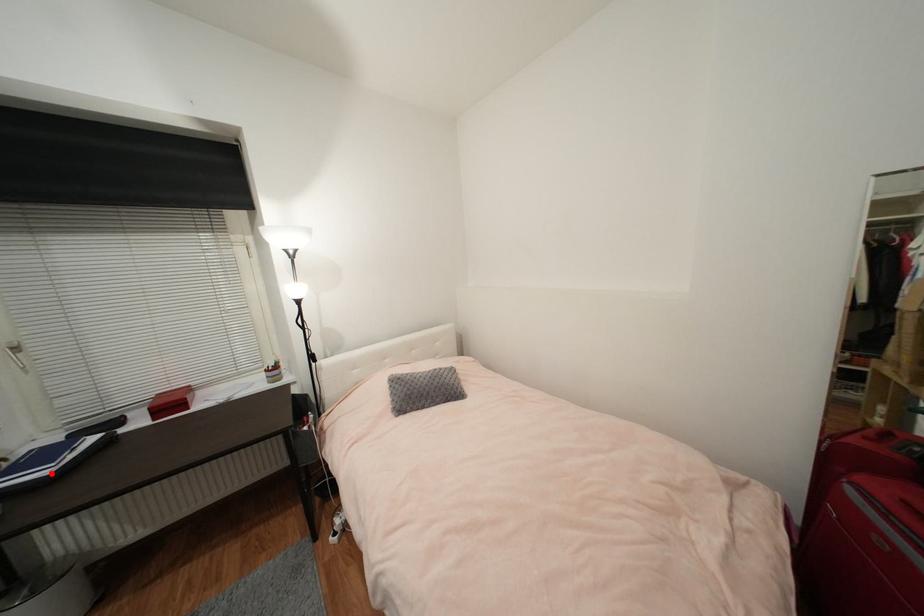
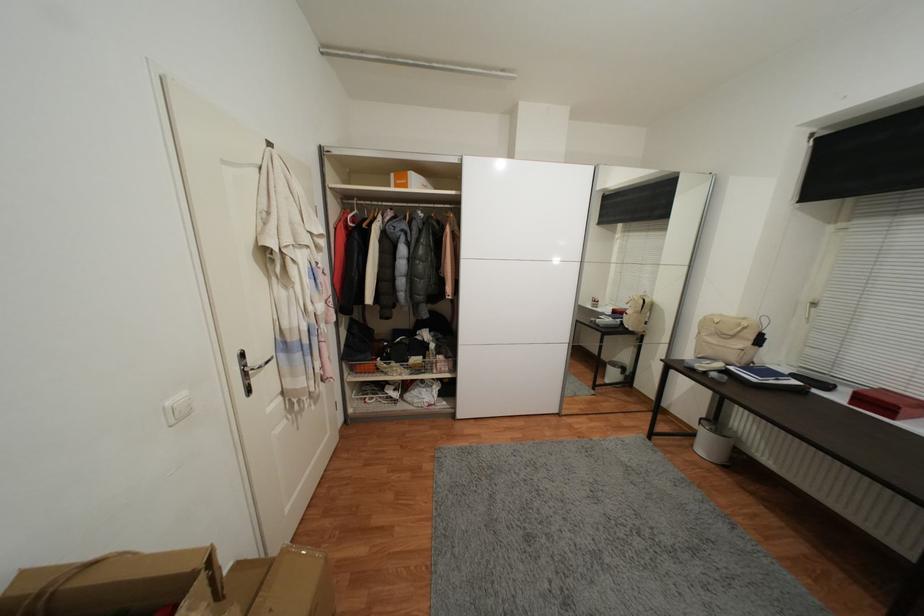
Question: I am providing you with two images of the same scene from different viewpoints. A red point is marked on the first image. Is the red point's position out of view in image 2?

Choices:
 (A) Yes
 (B) No

Answer: (B)